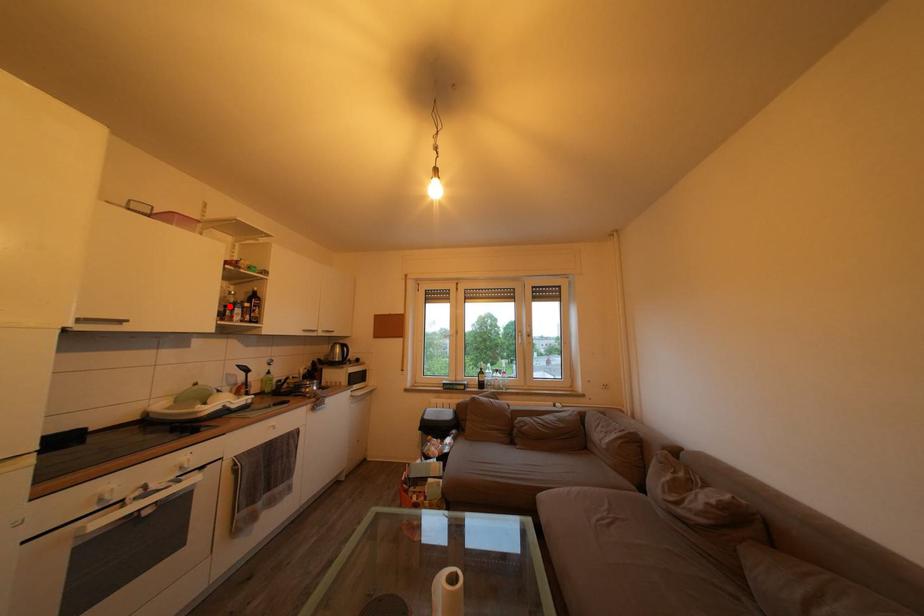
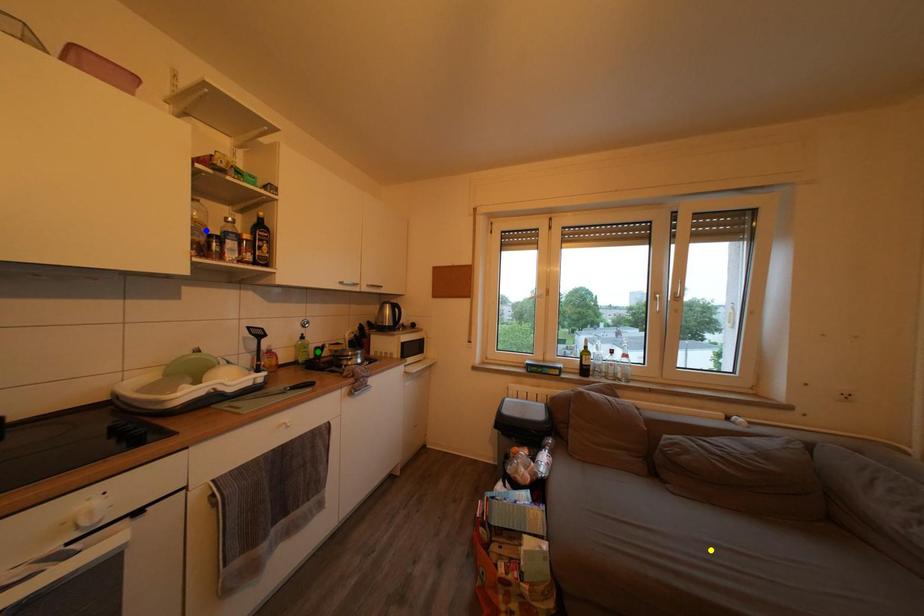
Question: I am providing you with two images of the same scene from different viewpoints. A red point is marked on the first image. You are given multiple points on the second image. Which point in image 2 represents the same 3d spot as the red point in image 1?

Choices:
 (A) blue point
 (B) green point
 (C) yellow point

Answer: (A)